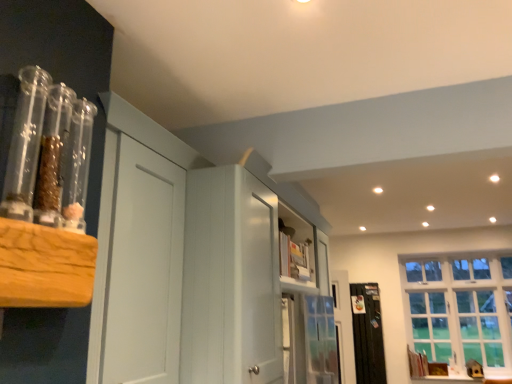
Question: Considering the relative sizes of black matte radiator at right and white painted wood cabinet at center in the image provided, is black matte radiator at right smaller than white painted wood cabinet at center?

Choices:
 (A) no
 (B) yes

Answer: (B)

Question: Does black matte radiator at right lie behind white painted wood cabinet at center?

Choices:
 (A) yes
 (B) no

Answer: (A)

Question: Does black matte radiator at right appear on the left side of white painted wood cabinet at center?

Choices:
 (A) no
 (B) yes

Answer: (A)

Question: Can you confirm if black matte radiator at right is wider than white painted wood cabinet at center?

Choices:
 (A) no
 (B) yes

Answer: (A)

Question: Is black matte radiator at right aimed at white painted wood cabinet at center?

Choices:
 (A) no
 (B) yes

Answer: (A)

Question: Is black matte radiator at right wider or thinner than white glass window at right?

Choices:
 (A) wide
 (B) thin

Answer: (B)

Question: Would you say black matte radiator at right is inside or outside white glass window at right?

Choices:
 (A) outside
 (B) inside

Answer: (A)

Question: From a real-world perspective, is black matte radiator at right positioned above or below white glass window at right?

Choices:
 (A) below
 (B) above

Answer: (A)

Question: Is black matte radiator at right bigger or smaller than white glass window at right?

Choices:
 (A) small
 (B) big

Answer: (A)

Question: From a real-world perspective, is white glass window at right positioned above or below black matte radiator at right?

Choices:
 (A) above
 (B) below

Answer: (A)

Question: From the image's perspective, is white glass window at right positioned above or below black matte radiator at right?

Choices:
 (A) above
 (B) below

Answer: (A)

Question: Is white glass window at right situated inside black matte radiator at right or outside?

Choices:
 (A) outside
 (B) inside

Answer: (A)

Question: From their relative heights in the image, would you say white glass window at right is taller or shorter than black matte radiator at right?

Choices:
 (A) tall
 (B) short

Answer: (A)

Question: From a real-world perspective, relative to white painted wood cabinet at center, is black matte radiator at right vertically above or below?

Choices:
 (A) above
 (B) below

Answer: (B)

Question: Is point (376, 332) positioned closer to the camera than point (221, 215)?

Choices:
 (A) farther
 (B) closer

Answer: (A)